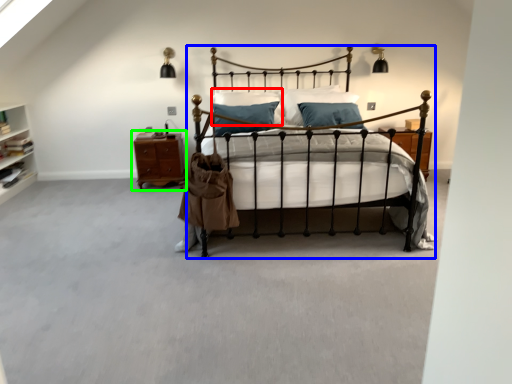
Question: Based on their relative distances, which object is farther from pillow (highlighted by a red box)? Choose from bed (highlighted by a blue box) and nightstand (highlighted by a green box).

Choices:
 (A) bed
 (B) nightstand

Answer: (A)